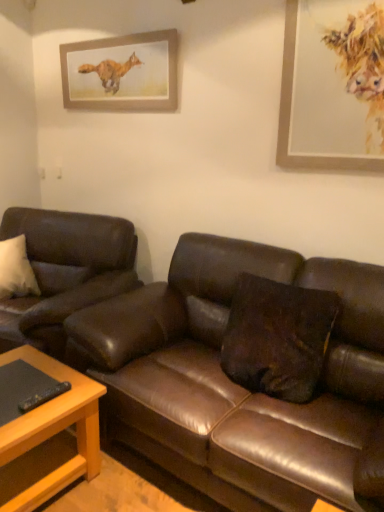
Question: From a real-world perspective, is wooden picture frame at upper right, marked as the 1th picture frame in a front-to-back arrangement, positioned under brown leather pillow at center based on gravity?

Choices:
 (A) yes
 (B) no

Answer: (B)

Question: Is the depth of wooden picture frame at upper right, which ranks as the 2th picture frame in back-to-front order, less than that of brown leather pillow at center?

Choices:
 (A) no
 (B) yes

Answer: (A)

Question: Can you confirm if wooden picture frame at upper right, marked as the 1th picture frame in a front-to-back arrangement, is shorter than brown leather pillow at center?

Choices:
 (A) no
 (B) yes

Answer: (A)

Question: Can you confirm if wooden picture frame at upper right, marked as the 1th picture frame in a front-to-back arrangement, is positioned to the right of brown leather pillow at center?

Choices:
 (A) yes
 (B) no

Answer: (A)

Question: Is wooden picture frame at upper right, marked as the 1th picture frame in a front-to-back arrangement, to the left of brown leather pillow at center from the viewer's perspective?

Choices:
 (A) no
 (B) yes

Answer: (A)

Question: Is wooden picture frame at upper right, which is the 1th picture frame in right-to-left order, looking in the opposite direction of brown leather pillow at center?

Choices:
 (A) yes
 (B) no

Answer: (B)

Question: Considering the relative sizes of wooden picture frame at upper center, the second picture frame from the front, and light brown wooden table at lower left in the image provided, is wooden picture frame at upper center, the second picture frame from the front, smaller than light brown wooden table at lower left?

Choices:
 (A) yes
 (B) no

Answer: (A)

Question: Is wooden picture frame at upper center, positioned as the 1th picture frame in back-to-front order, wider than light brown wooden table at lower left?

Choices:
 (A) yes
 (B) no

Answer: (B)

Question: Does wooden picture frame at upper center, which is the 2th picture frame in right-to-left order, touch light brown wooden table at lower left?

Choices:
 (A) yes
 (B) no

Answer: (B)

Question: Is the depth of wooden picture frame at upper center, the second picture frame from the front, greater than that of light brown wooden table at lower left?

Choices:
 (A) no
 (B) yes

Answer: (B)

Question: From the image's perspective, does wooden picture frame at upper center, which is the 2th picture frame in right-to-left order, appear lower than light brown wooden table at lower left?

Choices:
 (A) no
 (B) yes

Answer: (A)

Question: Can you confirm if wooden picture frame at upper center, which is the 2th picture frame in right-to-left order, is taller than light brown wooden table at lower left?

Choices:
 (A) no
 (B) yes

Answer: (A)

Question: From the image's perspective, is light brown wooden table at lower left on wooden picture frame at upper center, the second picture frame from the front?

Choices:
 (A) no
 (B) yes

Answer: (A)